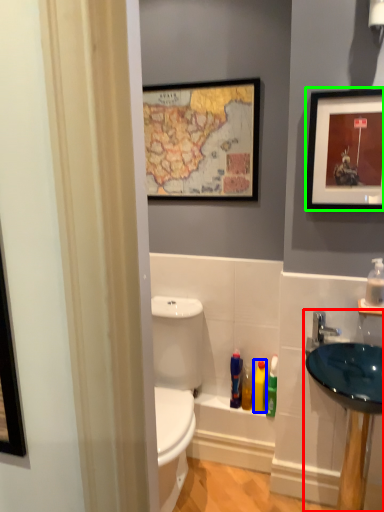
Question: Which object is positioned farthest from sink (highlighted by a red box)? Select from toiletry (highlighted by a blue box) and picture frame (highlighted by a green box).

Choices:
 (A) toiletry
 (B) picture frame

Answer: (B)